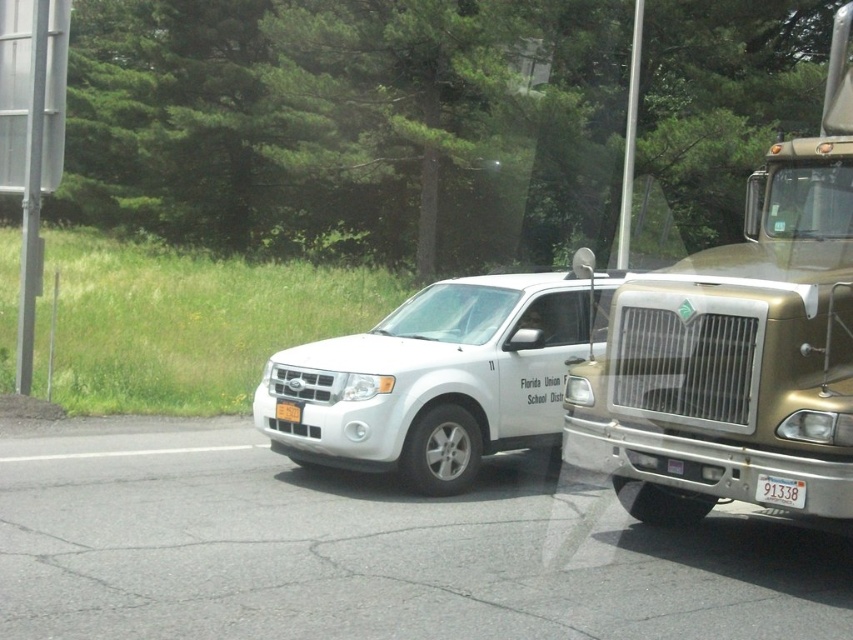
You are a driver trying to park your car in a spot that can only accommodate vehicles narrower than the yellow matte license plate at center. Can the gold metallic truck at right fit in this parking spot?

The gold metallic truck at right is wider than the yellow matte license plate at center, so it cannot fit in the parking spot designed for vehicles narrower than the yellow matte license plate at center.

You are standing at point (438, 378) in the image. What object are you directly facing?

You are directly facing the white matte SUV at center located at point (438, 378).